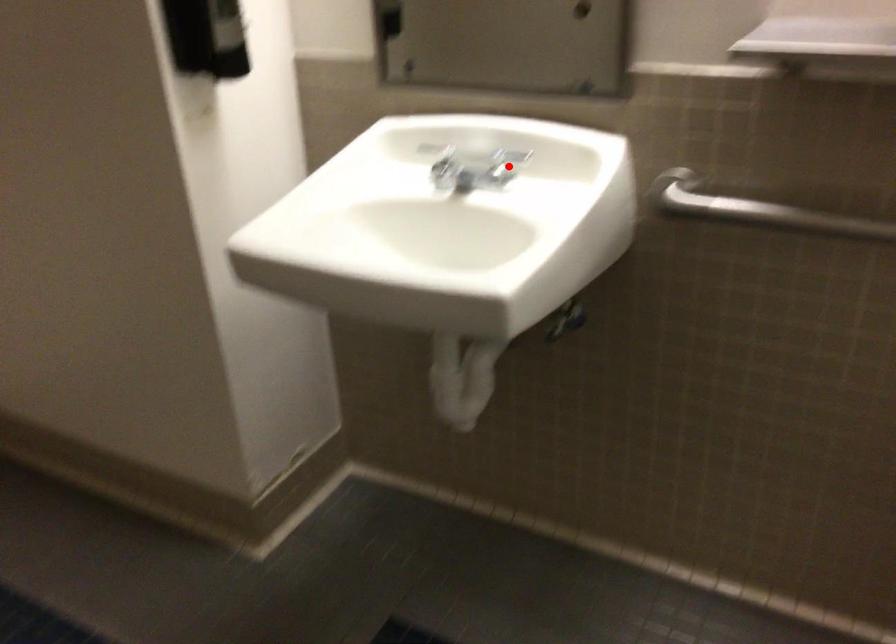
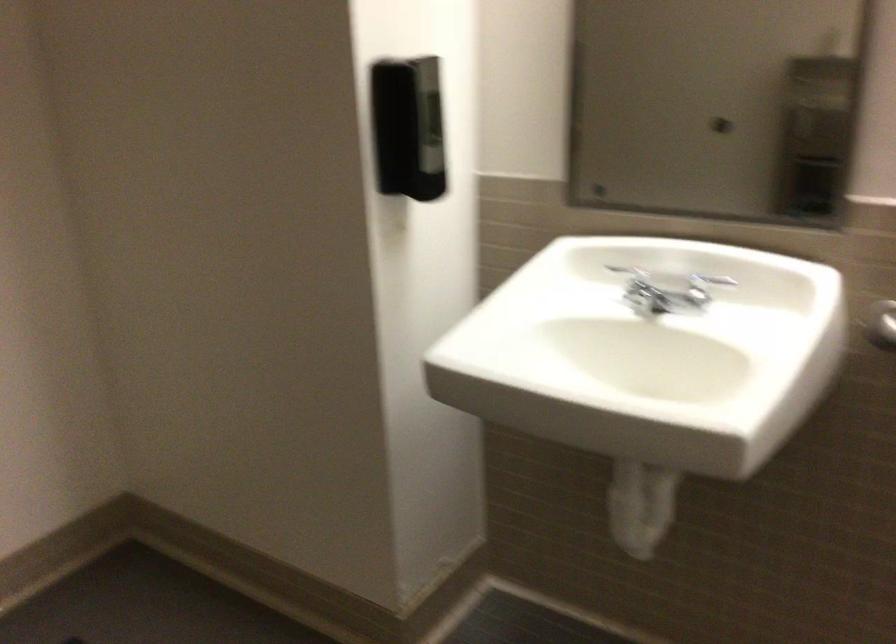
In the second image, find the point that corresponds to the highlighted location in the first image.

(704, 287)